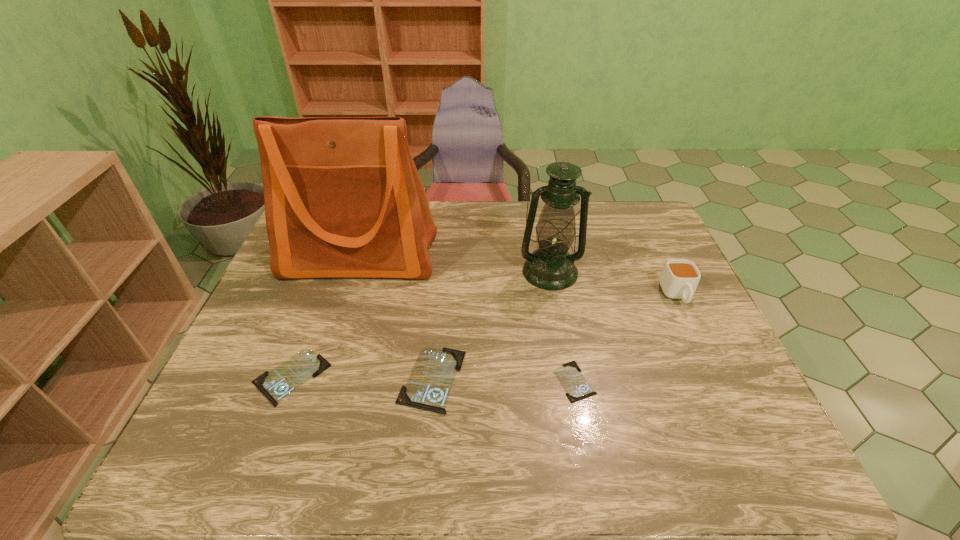
Please point a vacant point for placing a identity card on the right. Please provide its 2D coordinates. Your answer should be formatted as a tuple, i.e. [(x, y)], where the tuple contains the x and y coordinates of a point satisfying the conditions above.

[(718, 384)]